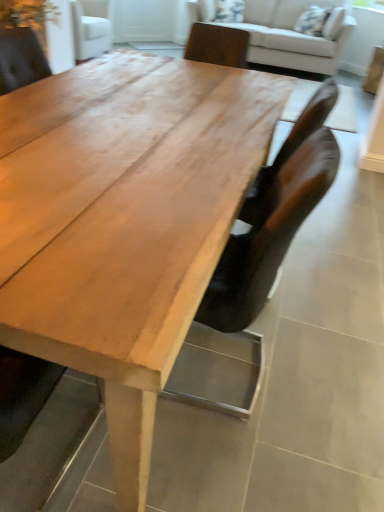
Question: Can you see brown leather chair at center touching light brown wood table at center?

Choices:
 (A) yes
 (B) no

Answer: (B)

Question: Is brown leather chair at center aimed at light brown wood table at center?

Choices:
 (A) yes
 (B) no

Answer: (A)

Question: Does brown leather chair at center come in front of light brown wood table at center?

Choices:
 (A) yes
 (B) no

Answer: (B)

Question: Can you confirm if brown leather chair at center is thinner than light brown wood table at center?

Choices:
 (A) yes
 (B) no

Answer: (A)

Question: Is brown leather chair at center not within light brown wood table at center?

Choices:
 (A) yes
 (B) no

Answer: (B)

Question: From a real-world perspective, is brown leather chair at center on light brown wood table at center?

Choices:
 (A) yes
 (B) no

Answer: (A)

Question: Can you confirm if light brown wood table at center is taller than brown leather chair at center?

Choices:
 (A) yes
 (B) no

Answer: (B)

Question: Is light brown wood table at center far from brown leather chair at center?

Choices:
 (A) yes
 (B) no

Answer: (B)

Question: Are light brown wood table at center and brown leather chair at center beside each other?

Choices:
 (A) yes
 (B) no

Answer: (B)

Question: Does light brown wood table at center lie behind brown leather chair at center?

Choices:
 (A) yes
 (B) no

Answer: (B)

Question: Can brown leather chair at center be found inside light brown wood table at center?

Choices:
 (A) yes
 (B) no

Answer: (A)

Question: Would you say light brown wood table at center is outside brown leather chair at center?

Choices:
 (A) no
 (B) yes

Answer: (B)

Question: Does light brown wood table at center have a smaller size compared to light beige fabric couch at upper center?

Choices:
 (A) no
 (B) yes

Answer: (B)